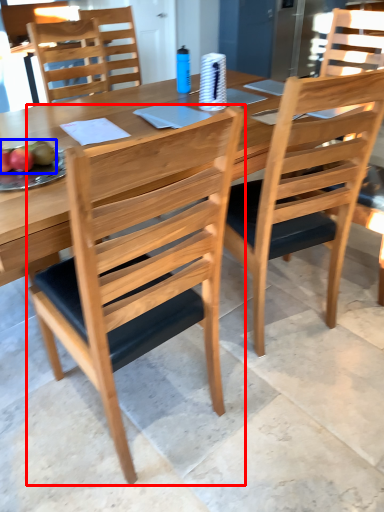
Question: Which of the following is the closest to the observer, chair (highlighted by a red box) or fruit (highlighted by a blue box)?

Choices:
 (A) chair
 (B) fruit

Answer: (A)